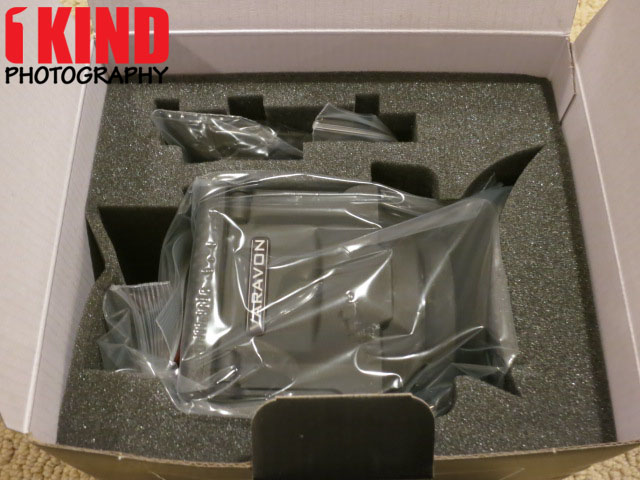
Find the location of a particular element. rug is located at coordinates pos(591,3), pos(10,460), pos(624,467).